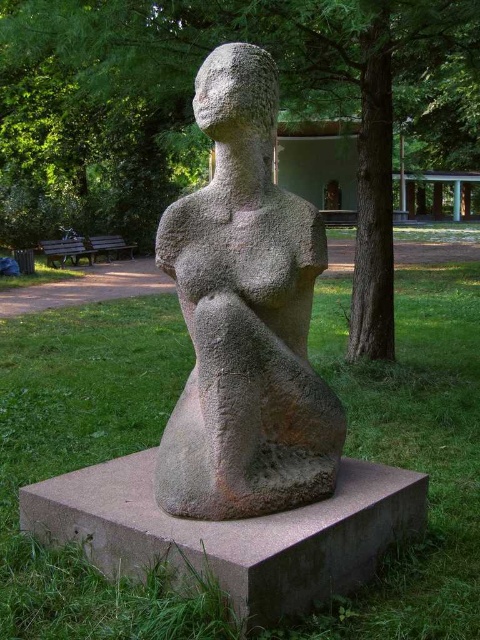
Question: Among these points, which one is nearest to the camera?

Choices:
 (A) (119, 244)
 (B) (76, 259)
 (C) (454, 88)

Answer: (C)

Question: Estimate the real-world distances between objects in this image. Which object is closer to the green textured tree at center?

Choices:
 (A) wooden park bench at center
 (B) green grass at center

Answer: (A)

Question: Is green grass at center wider than wooden park bench at center?

Choices:
 (A) yes
 (B) no

Answer: (A)

Question: Can you confirm if green grass at center is bigger than wooden park bench at center?

Choices:
 (A) no
 (B) yes

Answer: (A)

Question: Which object is closer to the camera taking this photo?

Choices:
 (A) green grass at center
 (B) wooden park bench at left

Answer: (A)

Question: Observing the image, what is the correct spatial positioning of green textured tree at center in reference to granite statue at center?

Choices:
 (A) below
 (B) above

Answer: (B)